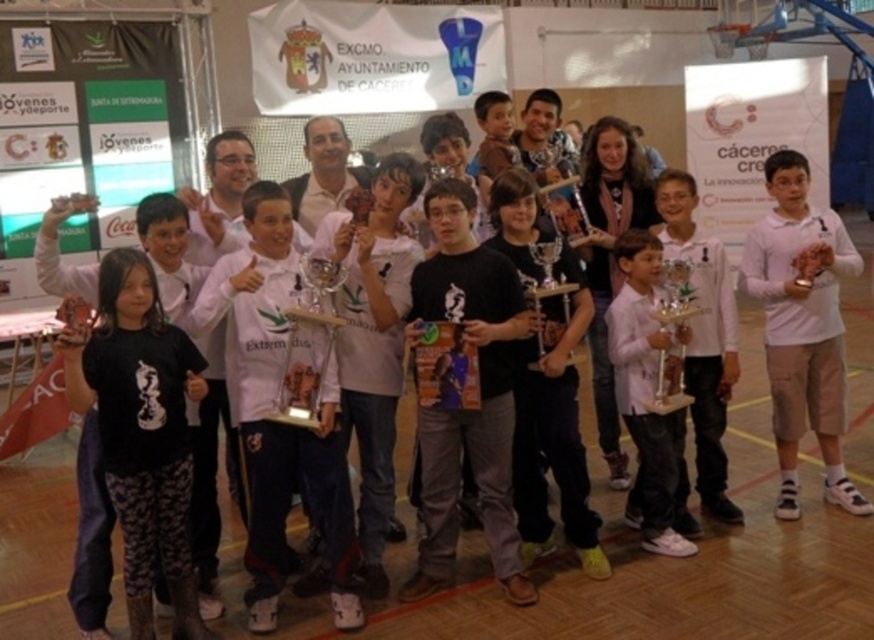
Is the position of white matte shirt at center more distant than that of pink matte shirt at center?

No, it is not.

Can you confirm if white matte shirt at center is positioned below pink matte shirt at center?

Indeed, white matte shirt at center is positioned under pink matte shirt at center.

The image size is (874, 640). I want to click on white matte shirt at center, so click(x=274, y=406).

Does black matte t-shirt at lower left have a lesser height compared to white matte shirt at center?

Correct, black matte t-shirt at lower left is not as tall as white matte shirt at center.

Is point (148, 532) positioned before point (247, 604)?

Yes, it is in front of point (247, 604).

Between point (126, 476) and point (325, 412), which one is positioned behind?

Positioned behind is point (325, 412).

Locate an element on the screen. Image resolution: width=874 pixels, height=640 pixels. black matte t-shirt at lower left is located at coordinates (141, 432).

Does white matte shirt at center appear on the left side of clear glass trophy at center?

Indeed, white matte shirt at center is positioned on the left side of clear glass trophy at center.

Is white matte shirt at center to the right of clear glass trophy at center from the viewer's perspective?

No, white matte shirt at center is not to the right of clear glass trophy at center.

I want to click on white matte shirt at center, so click(x=274, y=406).

Locate an element on the screen. white matte shirt at center is located at coordinates (274, 406).